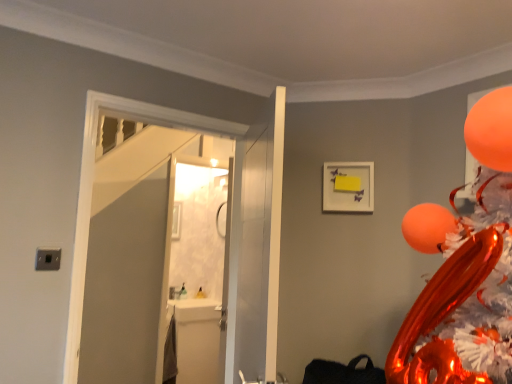
Question: Does orange glossy balloon at upper right come behind white matte picture frame at upper center?

Choices:
 (A) no
 (B) yes

Answer: (A)

Question: Is orange glossy balloon at upper right oriented towards white matte picture frame at upper center?

Choices:
 (A) yes
 (B) no

Answer: (B)

Question: Does orange glossy balloon at upper right come in front of white matte picture frame at upper center?

Choices:
 (A) no
 (B) yes

Answer: (B)

Question: Is orange glossy balloon at upper right with white matte picture frame at upper center?

Choices:
 (A) yes
 (B) no

Answer: (B)

Question: Can you confirm if orange glossy balloon at upper right is taller than white matte picture frame at upper center?

Choices:
 (A) no
 (B) yes

Answer: (B)

Question: Does orange glossy balloon at upper right have a lesser height compared to white matte picture frame at upper center?

Choices:
 (A) yes
 (B) no

Answer: (B)

Question: Considering the relative sizes of white glossy door at center, the 2th door when ordered from left to right, and white glossy sink at lower left in the image provided, is white glossy door at center, the 2th door when ordered from left to right, bigger than white glossy sink at lower left?

Choices:
 (A) yes
 (B) no

Answer: (A)

Question: Is white glossy door at center, the 1th door in the right-to-left sequence, to the right of white glossy sink at lower left from the viewer's perspective?

Choices:
 (A) yes
 (B) no

Answer: (A)

Question: Can you confirm if white glossy door at center, the 2th door when ordered from left to right, is thinner than white glossy sink at lower left?

Choices:
 (A) yes
 (B) no

Answer: (A)

Question: From a real-world perspective, is white glossy door at center, the 1th door in the right-to-left sequence, physically below white glossy sink at lower left?

Choices:
 (A) yes
 (B) no

Answer: (B)

Question: Is white glossy door at center, the 2th door when ordered from left to right, positioned behind white glossy sink at lower left?

Choices:
 (A) no
 (B) yes

Answer: (A)

Question: Is white glossy door at center, the 1th door in the right-to-left sequence, in front of white glossy sink at lower left?

Choices:
 (A) yes
 (B) no

Answer: (A)

Question: Considering the relative sizes of white glossy door at center, the 2th door when ordered from left to right, and orange glossy balloon at upper right in the image provided, is white glossy door at center, the 2th door when ordered from left to right, thinner than orange glossy balloon at upper right?

Choices:
 (A) yes
 (B) no

Answer: (B)